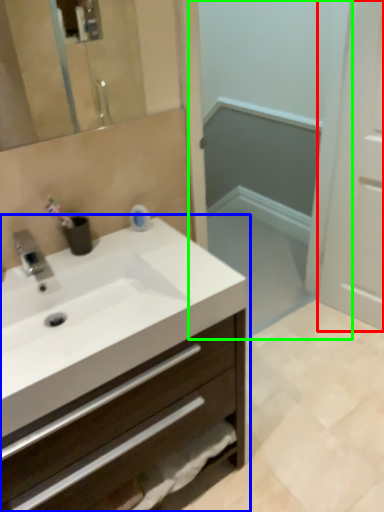
Question: Which object is the closest to the screen door (highlighted by a red box)? Choose among these: bathroom cabinet (highlighted by a blue box) or screen door (highlighted by a green box).

Choices:
 (A) bathroom cabinet
 (B) screen door

Answer: (B)